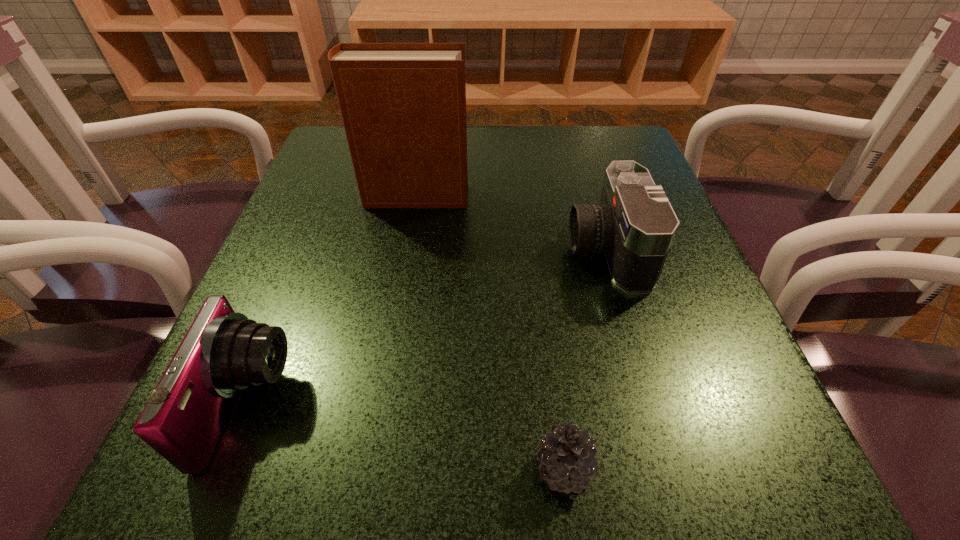
Where is `vacant point located between the leftmost object and the pinecone`? Image resolution: width=960 pixels, height=540 pixels. vacant point located between the leftmost object and the pinecone is located at coordinates (406, 437).

Image resolution: width=960 pixels, height=540 pixels. I want to click on vacant space that's between the pinecone and the leftmost object, so click(406, 437).

You are a GUI agent. You are given a task and a screenshot of the screen. Output one action in this format:
    pyautogui.click(x=<x>, y=<y>)
    Task: Click on the free area in between the third nearest object and the hardback book
    The image size is (960, 540).
    Given the screenshot: What is the action you would take?
    pyautogui.click(x=511, y=223)

At what (x,y) coordinates should I click in order to perform the action: click on free space between the right camera and the left camera. Please return your answer as a coordinate pair (x, y). The width and height of the screenshot is (960, 540). Looking at the image, I should click on (427, 327).

Locate an element on the screen. The width and height of the screenshot is (960, 540). vacant region between the right camera and the hardback book is located at coordinates click(511, 223).

At what (x,y) coordinates should I click in order to perform the action: click on free space between the tallest object and the rightmost object. Please return your answer as a coordinate pair (x, y). The height and width of the screenshot is (540, 960). Looking at the image, I should click on (511, 223).

Image resolution: width=960 pixels, height=540 pixels. In order to click on object that ranks as the closest to the pinecone in this screenshot , I will do `click(634, 224)`.

This screenshot has height=540, width=960. Find the location of `the third closest object relative to the farthest object`. the third closest object relative to the farthest object is located at coordinates (567, 456).

Locate an element on the screen. vacant space that satisfies the following two spatial constraints: 1. on the open cover of the farthest object; 2. on the right side of the pinecone is located at coordinates (368, 470).

Where is `blank area in the image that satisfies the following two spatial constraints: 1. on the front-facing side of the left camera; 2. on the back side of the pinecone`? Image resolution: width=960 pixels, height=540 pixels. blank area in the image that satisfies the following two spatial constraints: 1. on the front-facing side of the left camera; 2. on the back side of the pinecone is located at coordinates (223, 470).